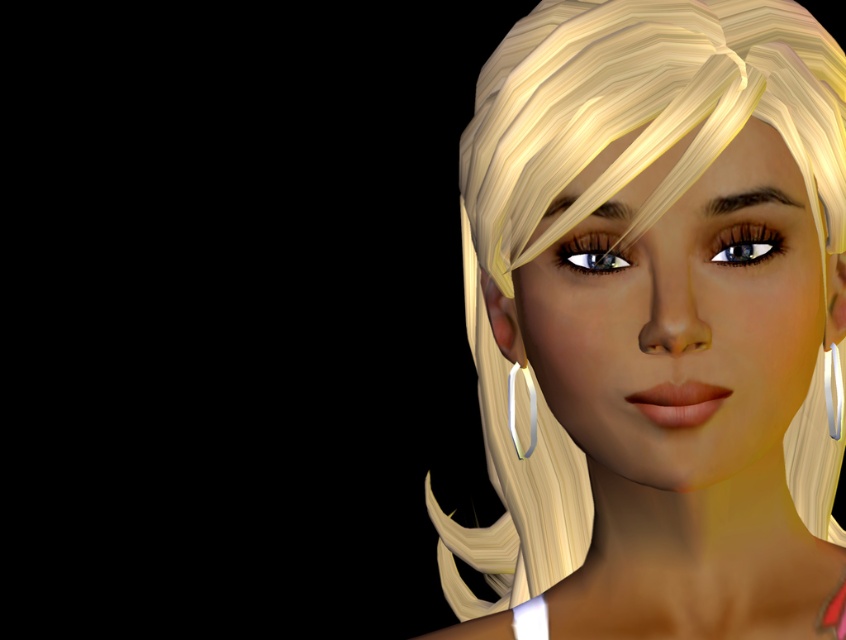
Can you confirm if shiny gold hair at center is thinner than silver metallic earring at right?

No, shiny gold hair at center is not thinner than silver metallic earring at right.

Is shiny gold hair at center below silver metallic earring at right?

Incorrect, shiny gold hair at center is not positioned below silver metallic earring at right.

Which is in front, point (728, 164) or point (828, 426)?

Point (728, 164) is in front.

Find the location of a particular element. shiny gold hair at center is located at coordinates (684, 336).

Is point (684, 3) in front of point (834, 429)?

Yes.

Does shiny blonde hair at center have a lesser height compared to silver metallic earring at right?

No.

Which is in front, point (713, 460) or point (828, 388)?

Point (713, 460) is in front.

This screenshot has height=640, width=846. Find the location of `shiny blonde hair at center`. shiny blonde hair at center is located at coordinates (656, 323).

Is shiny gold hair at center to the left of shiny blue eye at center from the viewer's perspective?

Incorrect, shiny gold hair at center is not on the left side of shiny blue eye at center.

Does shiny gold hair at center come in front of shiny blue eye at center?

Yes, it is.

The image size is (846, 640). What do you see at coordinates (684, 336) in the screenshot?
I see `shiny gold hair at center` at bounding box center [684, 336].

I want to click on shiny gold hair at center, so click(684, 336).